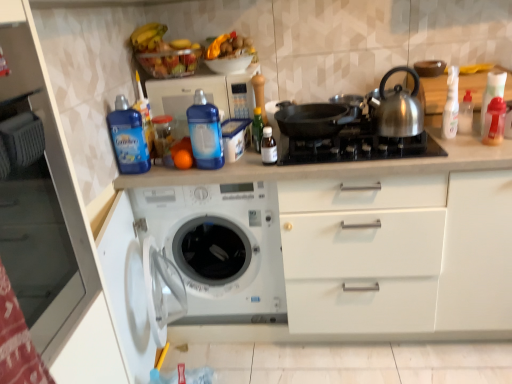
Locate an element on the screen. The height and width of the screenshot is (384, 512). vacant space situated on the left part of transparent plastic bottle at center, the 4th bottle in the right-to-left sequence is located at coordinates (241, 166).